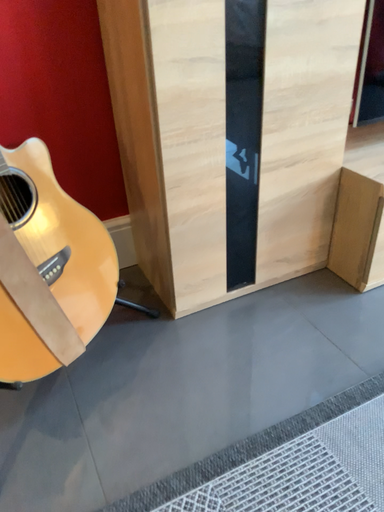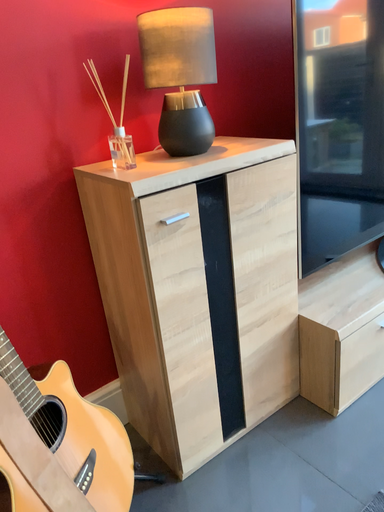
Question: Which way did the camera rotate in the video?

Choices:
 (A) rotated left
 (B) rotated right

Answer: (B)